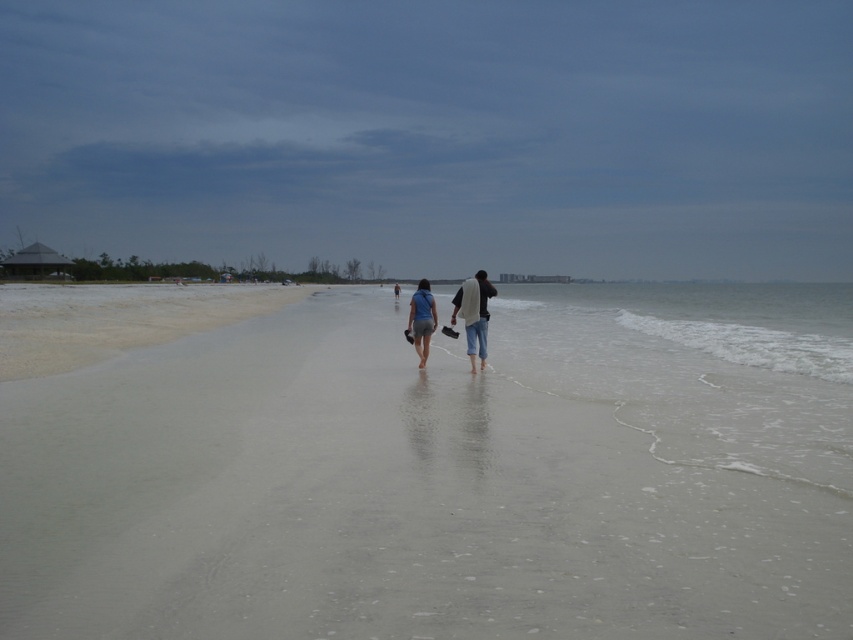
Question: Can you confirm if sandy beach at center is positioned to the left of white sand at lower left?

Choices:
 (A) no
 (B) yes

Answer: (A)

Question: Does sandy beach at center appear over denim pants at center?

Choices:
 (A) yes
 (B) no

Answer: (A)

Question: Among these points, which one is nearest to the camera?

Choices:
 (A) (482, 342)
 (B) (428, 344)
 (C) (485, 307)
 (D) (265, 310)

Answer: (C)

Question: Can you confirm if sandy beach at center is positioned above white sand at lower left?

Choices:
 (A) no
 (B) yes

Answer: (A)

Question: Which point is closer to the camera?

Choices:
 (A) (142, 316)
 (B) (424, 355)

Answer: (B)

Question: Among these points, which one is nearest to the camera?

Choices:
 (A) (459, 289)
 (B) (431, 326)
 (C) (474, 288)

Answer: (C)